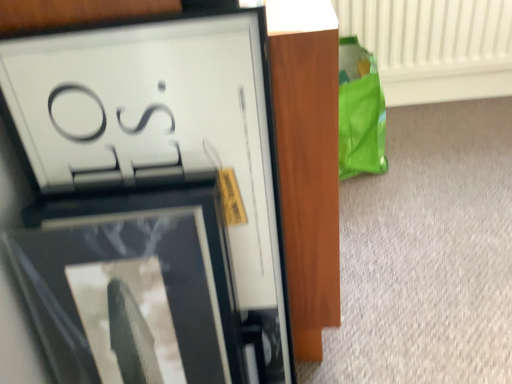
Question: Would you say matte black picture frame at upper left, the 1th picture frame when ordered from bottom to top, is outside matte black picture frame at upper left, the 1th picture frame viewed from the top?

Choices:
 (A) no
 (B) yes

Answer: (B)

Question: Is matte black picture frame at upper left, the 2th picture frame when ordered from top to bottom, with matte black picture frame at upper left, the 2th picture frame ordered from the bottom?

Choices:
 (A) no
 (B) yes

Answer: (B)

Question: Can you confirm if matte black picture frame at upper left, the 1th picture frame when ordered from bottom to top, is positioned to the left of matte black picture frame at upper left, the 1th picture frame viewed from the top?

Choices:
 (A) no
 (B) yes

Answer: (B)

Question: Considering the relative sizes of matte black picture frame at upper left, the 1th picture frame when ordered from bottom to top, and matte black picture frame at upper left, the 1th picture frame viewed from the top, in the image provided, is matte black picture frame at upper left, the 1th picture frame when ordered from bottom to top, bigger than matte black picture frame at upper left, the 1th picture frame viewed from the top,?

Choices:
 (A) no
 (B) yes

Answer: (B)

Question: Considering the relative sizes of matte black picture frame at upper left, the 2th picture frame when ordered from top to bottom, and matte black picture frame at upper left, the 2th picture frame ordered from the bottom, in the image provided, is matte black picture frame at upper left, the 2th picture frame when ordered from top to bottom, shorter than matte black picture frame at upper left, the 2th picture frame ordered from the bottom,?

Choices:
 (A) no
 (B) yes

Answer: (B)

Question: Considering the relative sizes of matte black picture frame at upper left, the 1th picture frame when ordered from bottom to top, and matte black picture frame at upper left, the 1th picture frame viewed from the top, in the image provided, is matte black picture frame at upper left, the 1th picture frame when ordered from bottom to top, wider than matte black picture frame at upper left, the 1th picture frame viewed from the top,?

Choices:
 (A) yes
 (B) no

Answer: (A)

Question: From a real-world perspective, is white textured radiator at upper right positioned over matte black picture frame at upper left, the 1th picture frame when ordered from bottom to top, based on gravity?

Choices:
 (A) yes
 (B) no

Answer: (B)

Question: Does white textured radiator at upper right appear on the left side of matte black picture frame at upper left, the 2th picture frame when ordered from top to bottom?

Choices:
 (A) yes
 (B) no

Answer: (B)

Question: Is white textured radiator at upper right located outside matte black picture frame at upper left, the 2th picture frame when ordered from top to bottom?

Choices:
 (A) no
 (B) yes

Answer: (B)

Question: Considering the relative sizes of white textured radiator at upper right and matte black picture frame at upper left, the 2th picture frame when ordered from top to bottom, in the image provided, is white textured radiator at upper right thinner than matte black picture frame at upper left, the 2th picture frame when ordered from top to bottom,?

Choices:
 (A) yes
 (B) no

Answer: (A)

Question: From the image's perspective, is white textured radiator at upper right above matte black picture frame at upper left, the 1th picture frame when ordered from bottom to top?

Choices:
 (A) no
 (B) yes

Answer: (B)

Question: Considering the relative sizes of white textured radiator at upper right and matte black picture frame at upper left, the 1th picture frame when ordered from bottom to top, in the image provided, is white textured radiator at upper right taller than matte black picture frame at upper left, the 1th picture frame when ordered from bottom to top,?

Choices:
 (A) no
 (B) yes

Answer: (A)

Question: Is matte black picture frame at upper left, the 1th picture frame viewed from the top, outside of white textured radiator at upper right?

Choices:
 (A) no
 (B) yes

Answer: (B)